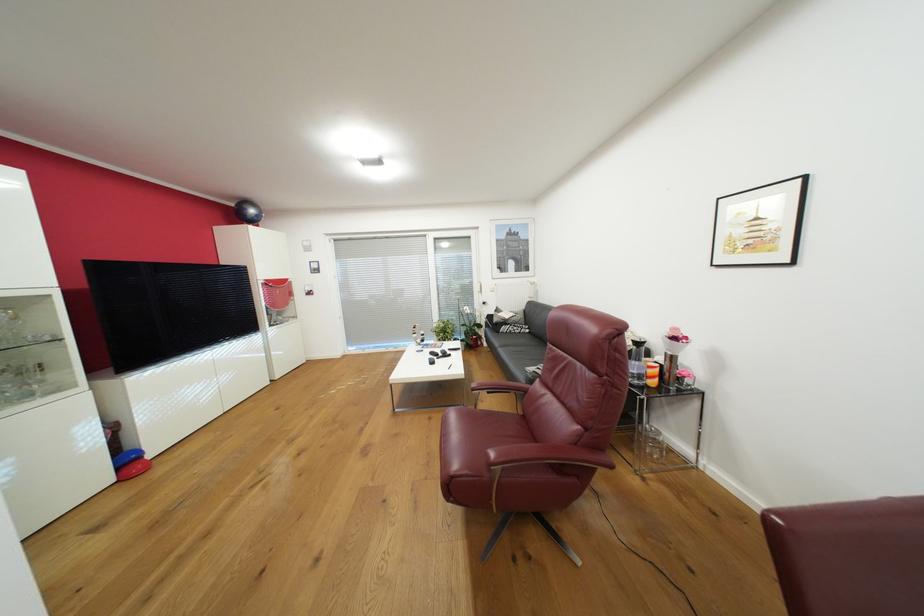
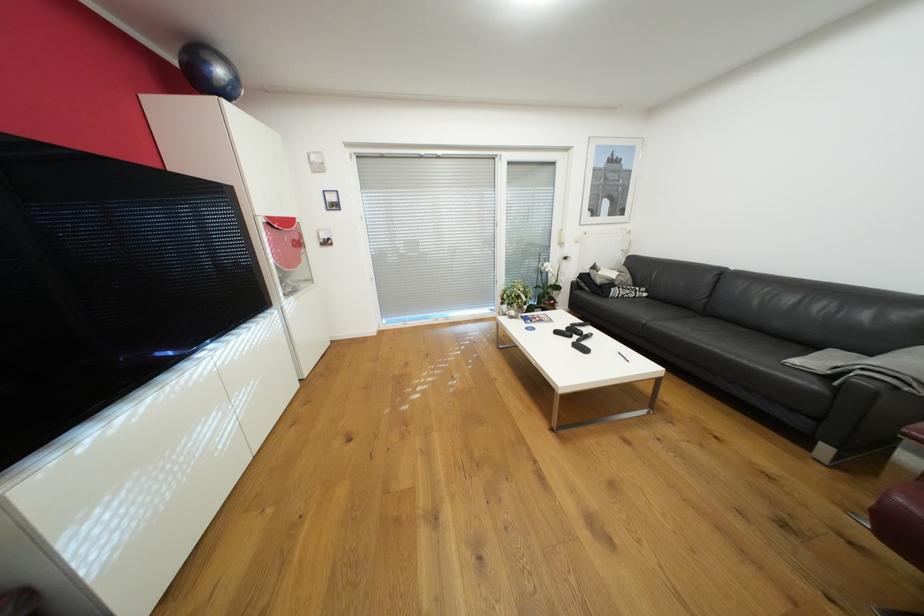
The images are taken continuously from a first-person perspective. In which direction are you moving?

The movement direction of the cameraman is left, forward.